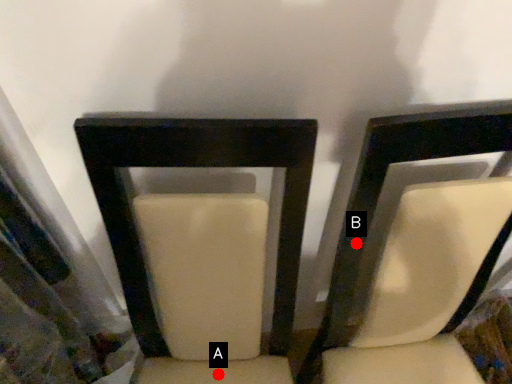
Question: Two points are circled on the image, labeled by A and B beside each circle. Which point is closer to the camera?

Choices:
 (A) A is closer
 (B) B is closer

Answer: (B)